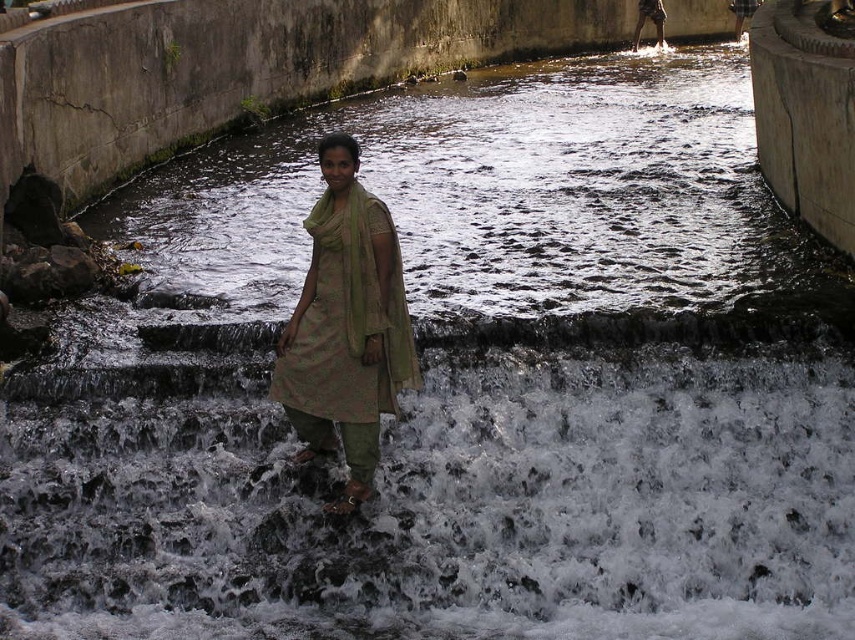
Between dark gray concrete waterway at center and green textured shawl at center, which one is positioned higher?

dark gray concrete waterway at center is higher up.

Which of these two, dark gray concrete waterway at center or green textured shawl at center, stands shorter?

green textured shawl at center

Does point (290, 291) come in front of point (320, 204)?

No, (290, 291) is behind (320, 204).

Identify the location of dark gray concrete waterway at center. (494, 198).

Can you confirm if dark gray concrete waterway at center is wider than green fabric dress at center?

Correct, the width of dark gray concrete waterway at center exceeds that of green fabric dress at center.

Does point (581, 113) lie behind point (360, 321)?

Yes, it is.

What are the coordinates of `dark gray concrete waterway at center` in the screenshot? It's located at (494, 198).

Is green fabric dress at center wider than green textured shawl at center?

Yes, green fabric dress at center is wider than green textured shawl at center.

Who is more distant from viewer, (275, 397) or (327, 205)?

Point (275, 397)

I want to click on green fabric dress at center, so click(346, 323).

Locate an element on the screen. The width and height of the screenshot is (855, 640). green fabric dress at center is located at coordinates (346, 323).